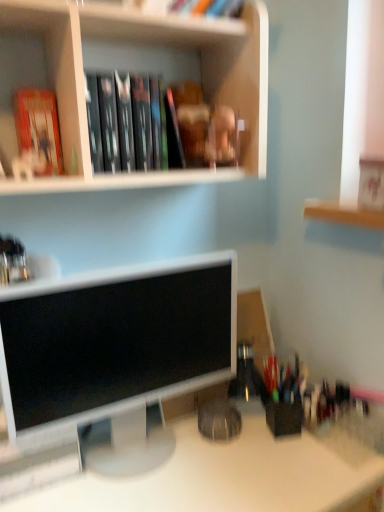
Question: Considering the positions of white matte bookshelf at upper center and hardcover books at upper center in the image, is white matte bookshelf at upper center taller or shorter than hardcover books at upper center?

Choices:
 (A) tall
 (B) short

Answer: (A)

Question: Considering their positions, is white matte bookshelf at upper center located in front of or behind hardcover books at upper center?

Choices:
 (A) behind
 (B) front

Answer: (B)

Question: Based on their relative distances, which object is nearer to the white matte bookshelf at upper center?

Choices:
 (A) matte white monitor at center
 (B) white glossy desk at center
 (C) hardcover book at upper left
 (D) hardcover books at upper center

Answer: (D)

Question: Estimate the real-world distances between objects in this image. Which object is closer to the white matte bookshelf at upper center?

Choices:
 (A) hardcover book at upper left
 (B) hardcover books at upper center
 (C) matte white monitor at center
 (D) white glossy desk at center

Answer: (B)